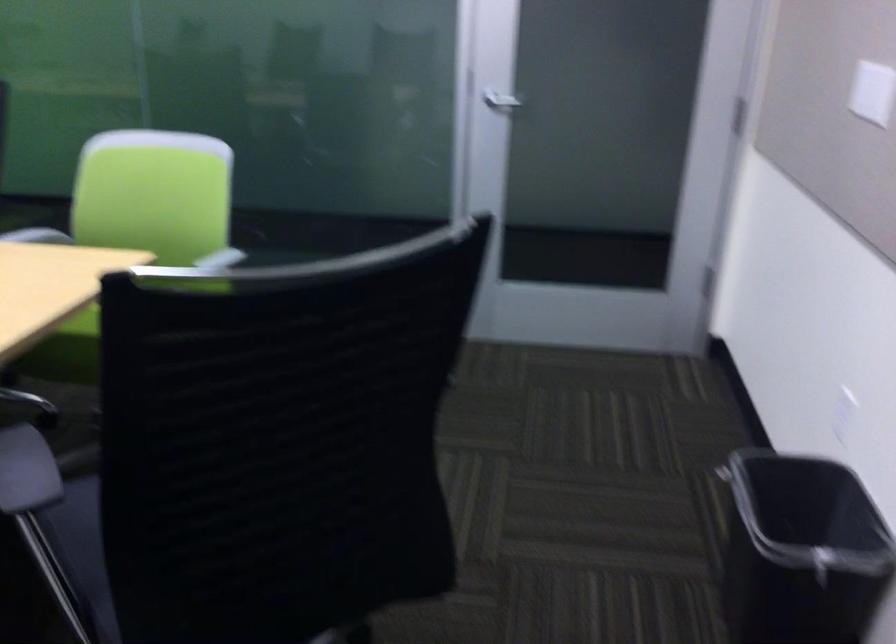
Describe the element at coordinates (800, 552) in the screenshot. I see `the black trash can` at that location.